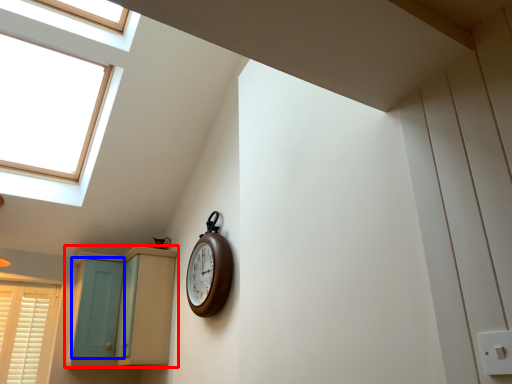
Question: Among these objects, which one is nearest to the camera, cabinetry (highlighted by a red box) or screen door (highlighted by a blue box)?

Choices:
 (A) cabinetry
 (B) screen door

Answer: (A)